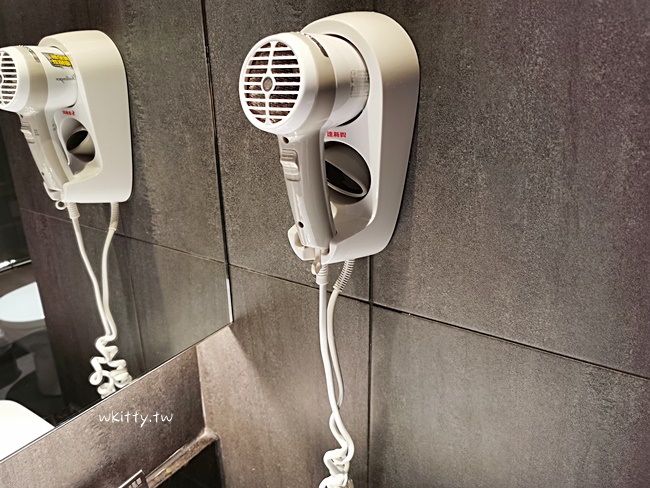
Where is `wall`? This screenshot has width=650, height=488. wall is located at coordinates (569, 257).